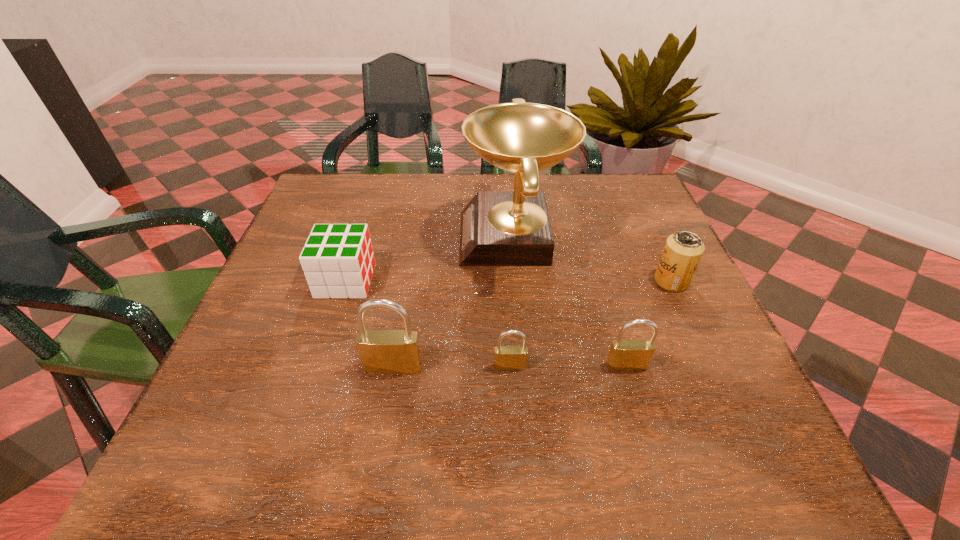
Please show where to add a padlock on the left while keeping spacing even. Please provide its 2D coordinates. Your answer should be formatted as a tuple, i.e. [(x, y)], where the tuple contains the x and y coordinates of a point satisfying the conditions above.

[(276, 368)]